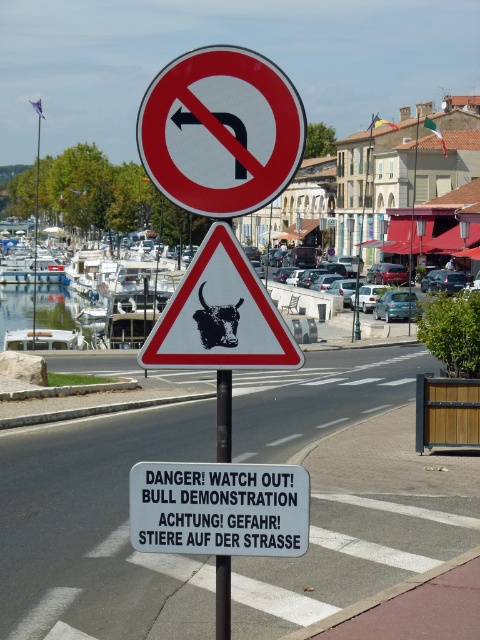
You are driving and see the red plastic sign at upper center and the white triangular warning sign with black bull at center at upper center. Which one is more to the left?

The red plastic sign at upper center is positioned on the left side of white triangular warning sign with black bull at center at upper center, so it is more to the left.

You are a delivery driver approaching this street and see the white triangular warning sign with black bull at center at upper center and the brushed metal pole at center. Which object is wider?

The white triangular warning sign with black bull at center at upper center is wider than the brushed metal pole at center.

What is the spatial relationship between the white triangular warning sign with black bull at center at upper center and the other signs on the traffic sign?

The white triangular warning sign with black bull at center at upper center is located at the middle section of the traffic sign, positioned between the top and bottom signs.